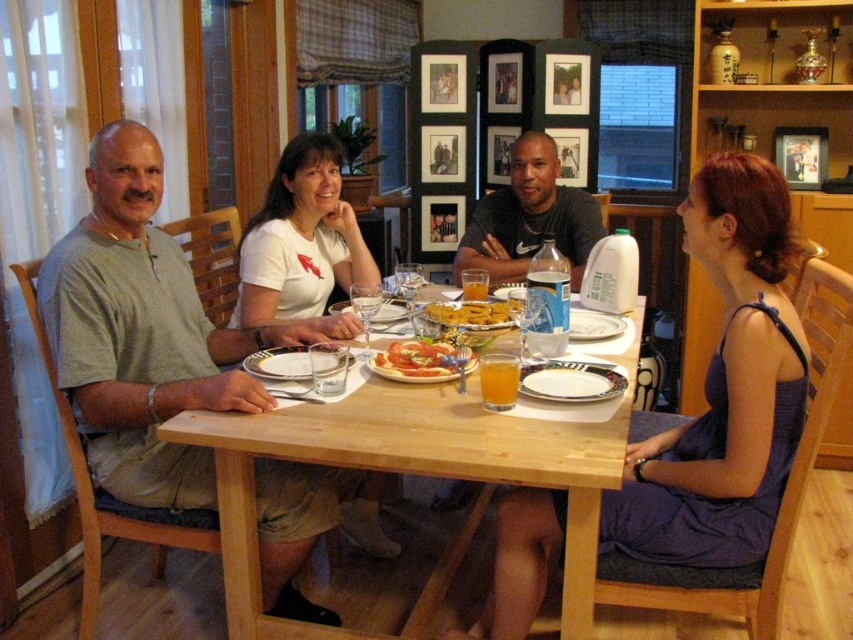
Question: Estimate the real-world distances between objects in this image. Which object is closer to the purple satin dress at right?

Choices:
 (A) tomato sauce pasta at center
 (B) matte gray t-shirt at left
 (C) white matte t-shirt at center

Answer: (A)

Question: Does matte gray t-shirt at left appear on the left side of light brown wooden table at center?

Choices:
 (A) no
 (B) yes

Answer: (B)

Question: Which object is positioned closest to the matte black shirt at center?

Choices:
 (A) light brown wooden table at center
 (B) purple satin dress at right

Answer: (A)

Question: Among these objects, which one is farthest from the camera?

Choices:
 (A) tomato sauce pasta at center
 (B) purple satin dress at right
 (C) light brown wooden table at center
 (D) matte gray t-shirt at left

Answer: (A)

Question: From the image, what is the correct spatial relationship of purple satin dress at right in relation to tomato sauce pasta at center?

Choices:
 (A) left
 (B) right

Answer: (B)

Question: Observing the image, what is the correct spatial positioning of matte black shirt at center in reference to tomato sauce pasta at center?

Choices:
 (A) left
 (B) right

Answer: (B)